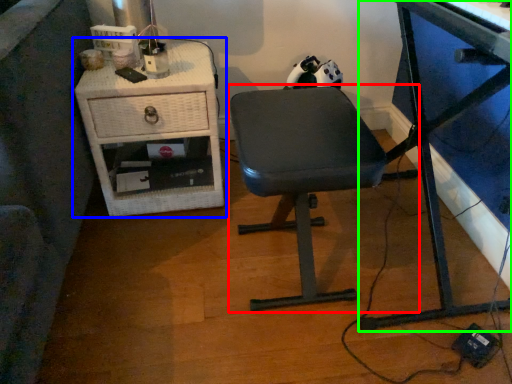
Question: Based on their relative distances, which object is nearer to chair (highlighted by a red box)? Choose from nightstand (highlighted by a blue box) and desk (highlighted by a green box).

Choices:
 (A) nightstand
 (B) desk

Answer: (B)